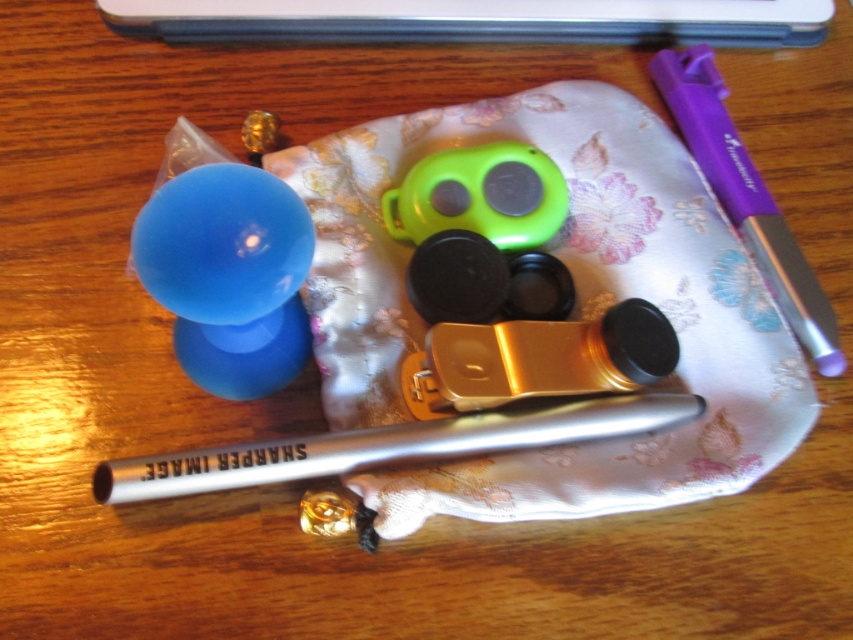
You are looking at the wooden surface where two points are marked. The first point is at coordinate (236,273) and the second is at (712,154). From your viewpoint, which point is closer to you?

Point (236,273) is in front of point (712,154), so it is closer to you.

You are standing in front of the wooden surface where the items are arranged. You see two points marked on the surface. The first point is at coordinates point (434, 365) and the second point is at point (244, 365). Which point is closer to you?

Point (434, 365) is in front of point (244, 365), so it is closer to you.